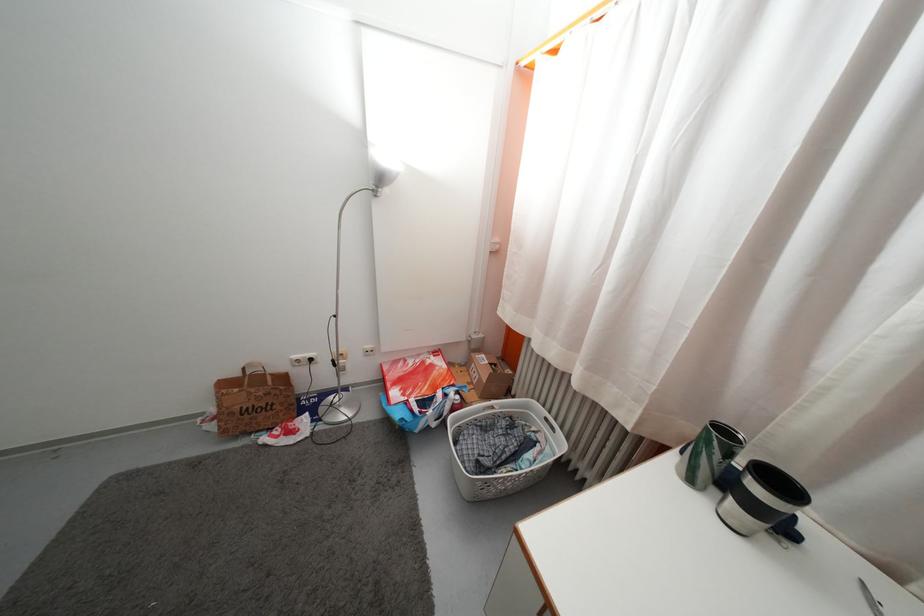
The image size is (924, 616). What are the coordinates of `brown paper bag handle` in the screenshot? It's located at (254, 371).